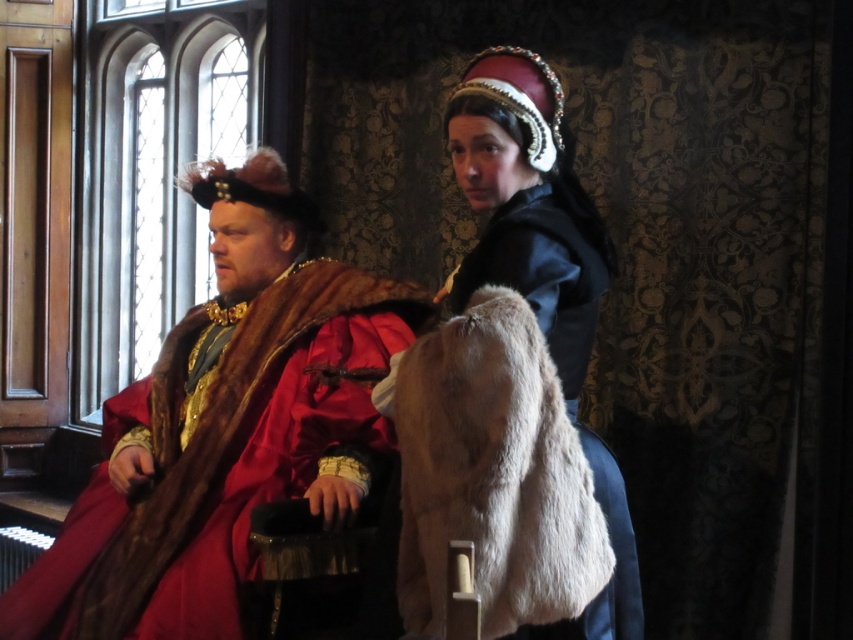
You are a tailor measuring the width of garments for a costume exhibition. You have two garments to assess, the velvet red robe at left and the velvet black dress at center. Which garment has a greater width?

The velvet red robe at left has a greater width than the velvet black dress at center according to the description.